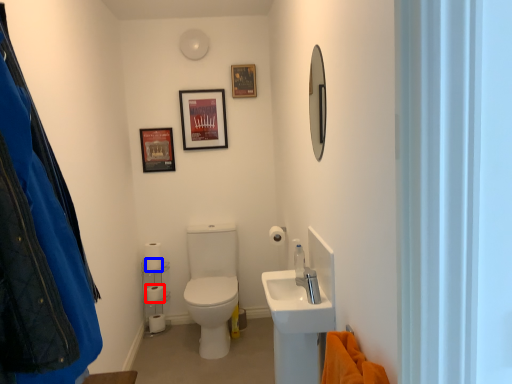
Question: Which of the following is the closest to the observer, toilet paper (highlighted by a red box) or toilet paper (highlighted by a blue box)?

Choices:
 (A) toilet paper
 (B) toilet paper

Answer: (B)